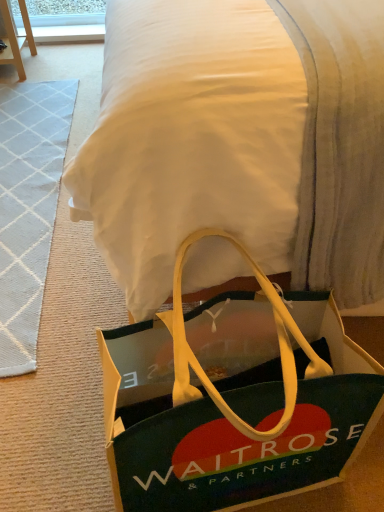
Question: Is point (39, 290) closer or farther from the camera than point (246, 303)?

Choices:
 (A) closer
 (B) farther

Answer: (B)

Question: In terms of size, does white textured rug at left appear bigger or smaller than green fabric bag at lower center?

Choices:
 (A) big
 (B) small

Answer: (B)

Question: Which object is positioned farthest from the white textured rug at left?

Choices:
 (A) green fabric bag at lower center
 (B) green fabric bag at lower center

Answer: (B)

Question: Estimate the real-world distances between objects in this image. Which object is closer to the green fabric bag at lower center?

Choices:
 (A) green fabric bag at lower center
 (B) white textured rug at left

Answer: (A)